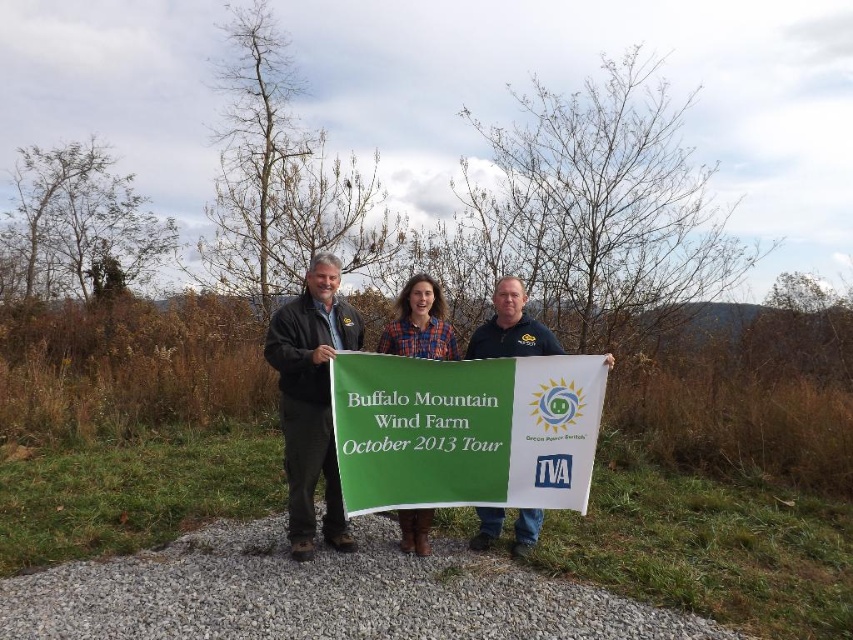
Does point (508, 337) lie in front of point (428, 317)?

Yes, it is in front of point (428, 317).

Who is more distant from viewer, (547,340) or (408,515)?

The point (408,515) is more distant.

What do you see at coordinates (509, 326) in the screenshot? I see `dark blue shirt at center` at bounding box center [509, 326].

Find the location of a particular element. The image size is (853, 640). dark blue shirt at center is located at coordinates (509, 326).

Is dark brown leather jacket at center below plaid fabric shirt at center?

Yes, dark brown leather jacket at center is below plaid fabric shirt at center.

Does dark brown leather jacket at center have a lesser width compared to plaid fabric shirt at center?

No, dark brown leather jacket at center is not thinner than plaid fabric shirt at center.

Locate an element on the screen. This screenshot has width=853, height=640. dark brown leather jacket at center is located at coordinates (311, 400).

The width and height of the screenshot is (853, 640). Find the location of `dark brown leather jacket at center`. dark brown leather jacket at center is located at coordinates (311, 400).

Is green fabric banner at center bigger than plaid fabric shirt at center?

Correct, green fabric banner at center is larger in size than plaid fabric shirt at center.

Is green fabric banner at center taller than plaid fabric shirt at center?

Yes.

Between point (457, 496) and point (432, 314), which one is positioned behind?

Positioned behind is point (432, 314).

Find the location of `green fabric banner at center`. green fabric banner at center is located at coordinates (465, 429).